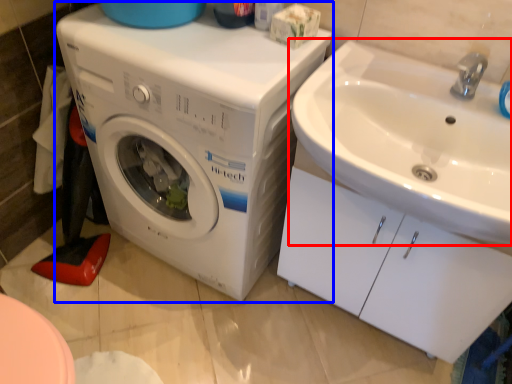
Question: Which object is further to the camera taking this photo, sink (highlighted by a red box) or washing machine (highlighted by a blue box)?

Choices:
 (A) sink
 (B) washing machine

Answer: (B)